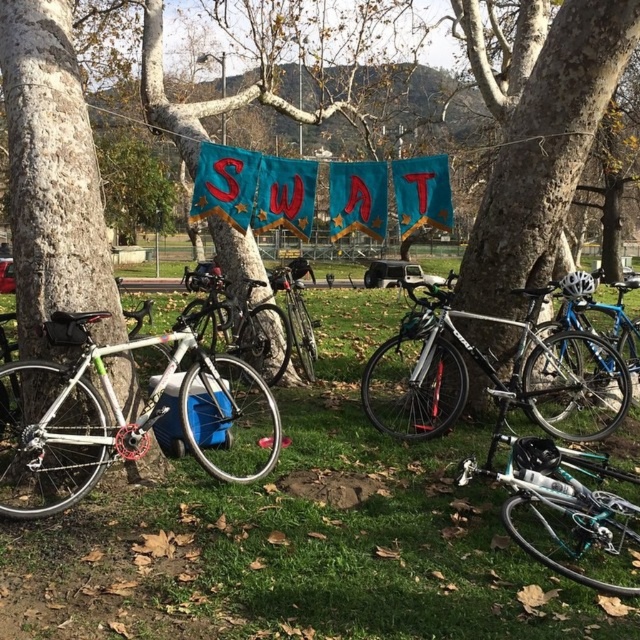
You are a photographer setting up a tripod in the park. You want to place your tripod on the green grass at lower center without blocking the shiny silver bicycle at center. Is this possible?

The green grass at lower center is below the shiny silver bicycle at center, so placing the tripod on the grass won

You are standing in the park and see the smooth bark tree at center and the shiny silver bicycle at center. Which object is positioned to the right of the other?

The smooth bark tree at center is positioned to the right of the shiny silver bicycle at center.

You are planning to place a small picnic basket on the green grass at lower center. Considering the height of the white matte bicycle at left, will the basket be visible from the front of the bicycle?

The green grass at lower center has a lesser height compared to white matte bicycle at left, so the picnic basket placed on the green grass at lower center will be visible from the front of the white matte bicycle at left since the grass is shorter than the bicycle.